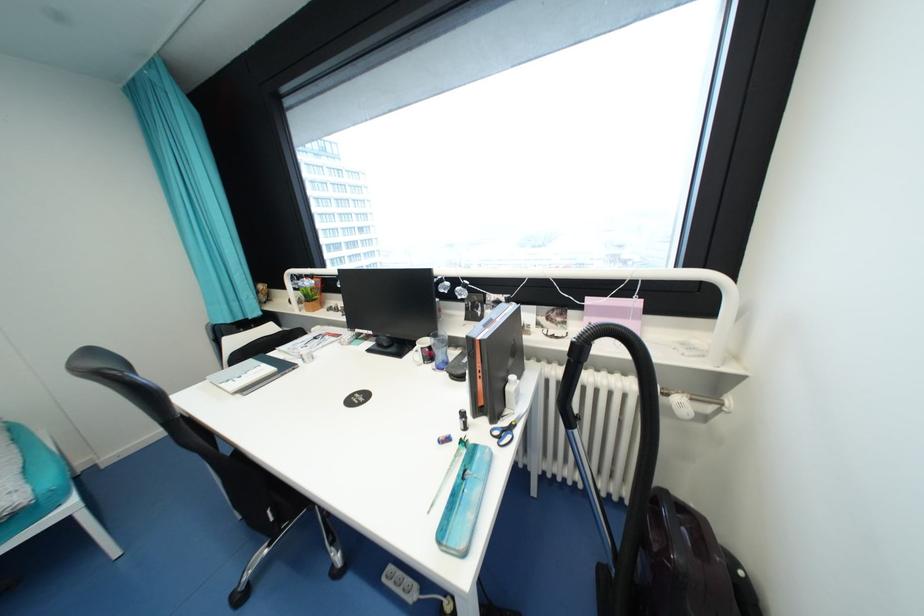
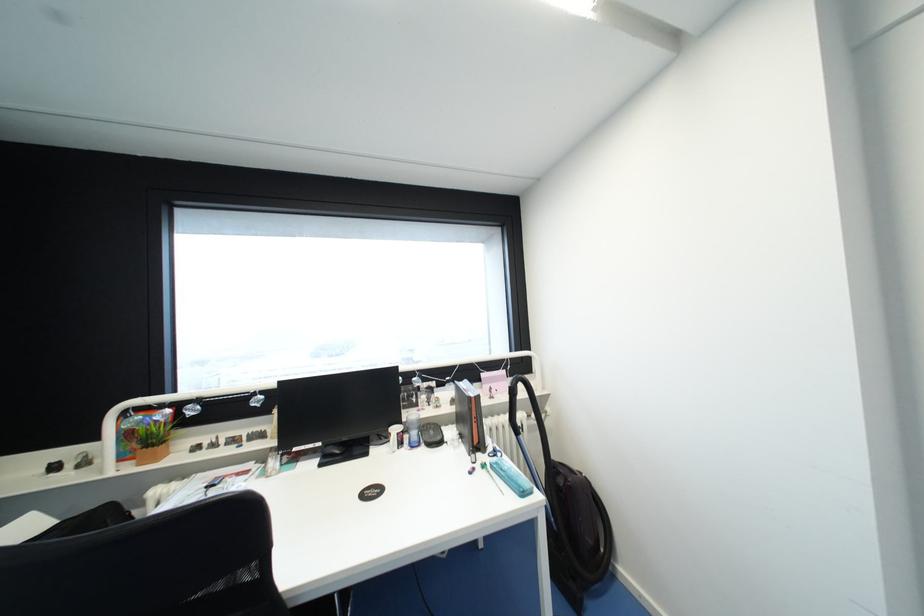
Locate, in the second image, the point that corresponds to point (375, 333) in the first image.

(323, 445)